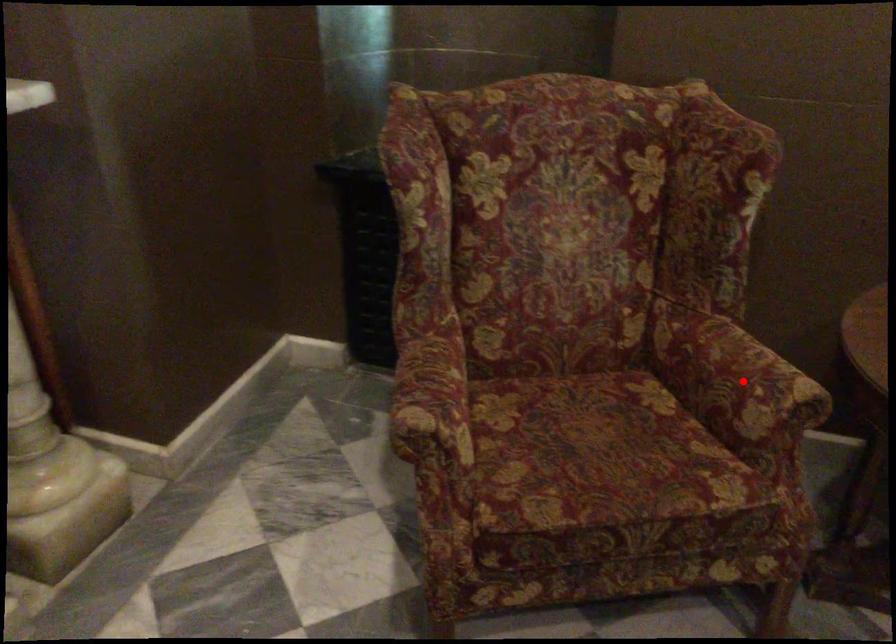
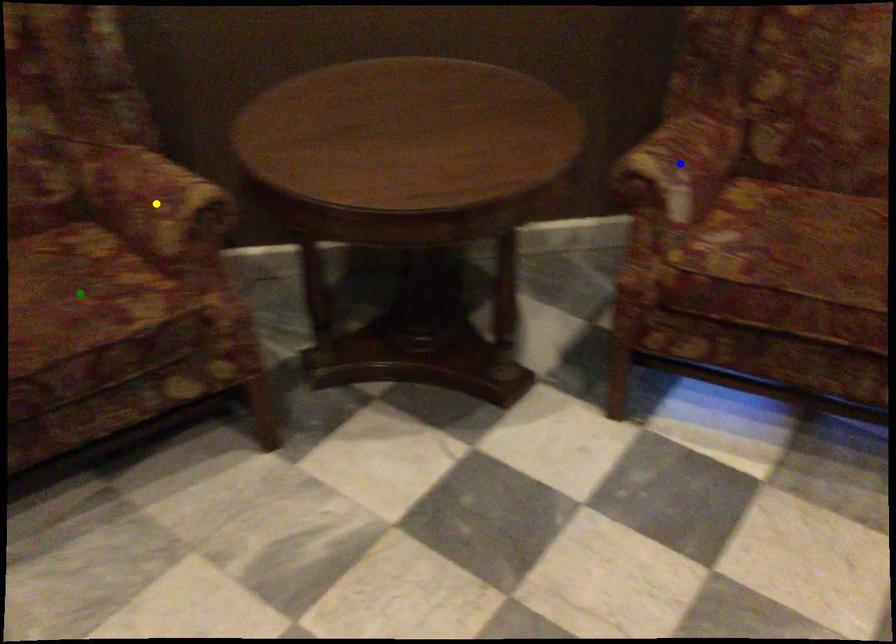
Question: I am providing you with two images of the same scene from different viewpoints. A red point is marked on the first image. You are given multiple points on the second image. Which point in image 2 represents the same 3d spot as the red point in image 1?

Choices:
 (A) yellow point
 (B) green point
 (C) blue point

Answer: (A)